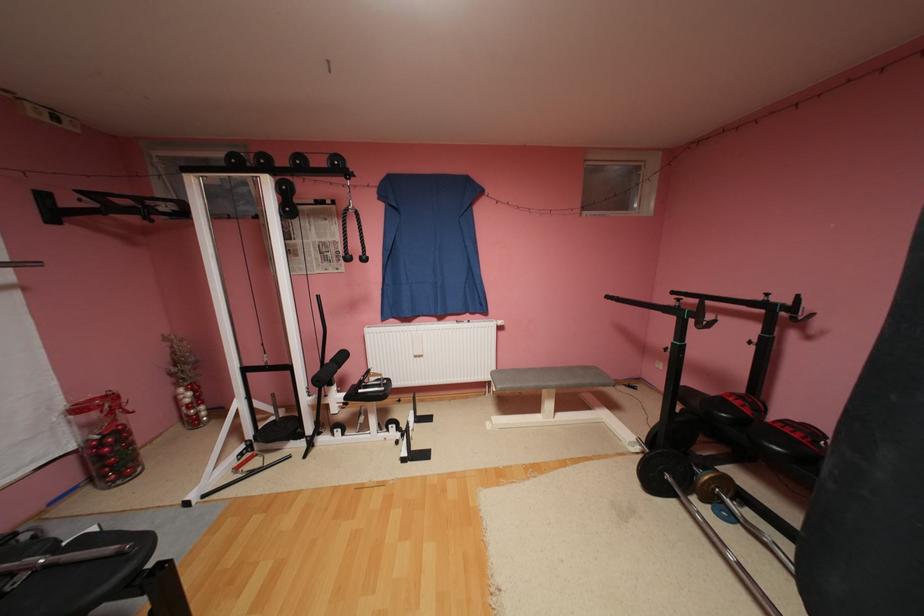
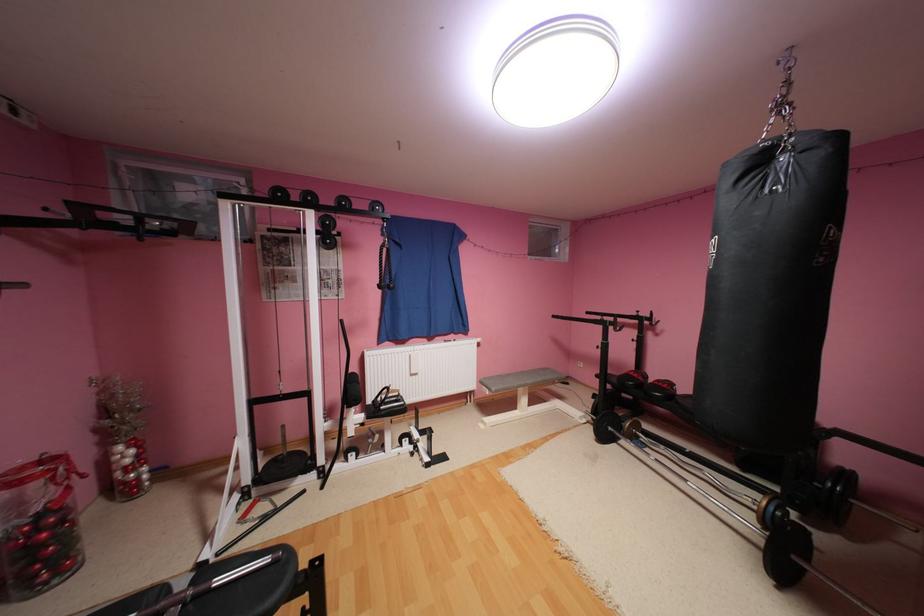
Question: The first image is from the beginning of the video and the second image is from the end. How did the camera likely rotate when shooting the video?

Choices:
 (A) Left
 (B) Right
 (C) Up
 (D) Down

Answer: (B)